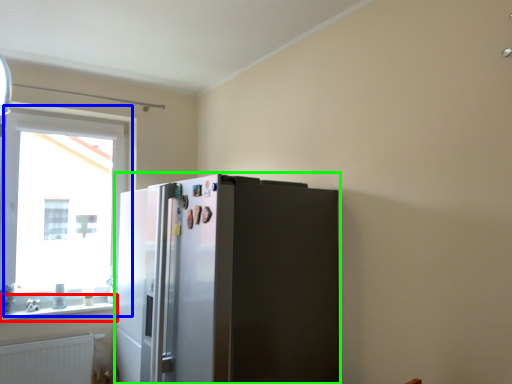
Question: Which is nearer to the window sill (highlighted by a red box)? window (highlighted by a blue box) or refrigerator (highlighted by a green box).

Choices:
 (A) window
 (B) refrigerator

Answer: (A)